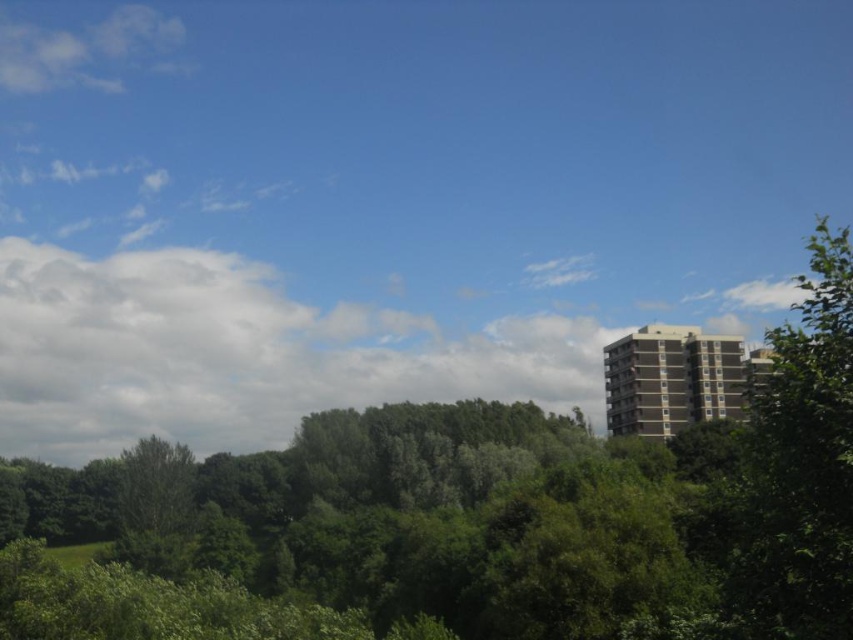
Is green leafy tree at upper center further to the viewer compared to green leafy tree at right?

Yes, green leafy tree at upper center is further from the viewer.

In the scene shown: Is green leafy tree at upper center above green leafy tree at right?

No, green leafy tree at upper center is not above green leafy tree at right.

The image size is (853, 640). Describe the element at coordinates (482, 509) in the screenshot. I see `green leafy tree at upper center` at that location.

Image resolution: width=853 pixels, height=640 pixels. I want to click on green leafy tree at upper center, so click(x=482, y=509).

Does point (828, 422) come closer to viewer compared to point (97, 45)?

Yes.

Is green leafy tree at right below white fluffy cloud at upper left?

Yes.

Is point (766, 465) positioned before point (15, 45)?

Yes, it is in front of point (15, 45).

Find the location of a particular element. The height and width of the screenshot is (640, 853). green leafy tree at right is located at coordinates (793, 474).

Can you confirm if green leafy tree at upper center is shorter than white fluffy cloud at upper left?

No, green leafy tree at upper center is not shorter than white fluffy cloud at upper left.

Locate an element on the screen. This screenshot has width=853, height=640. green leafy tree at upper center is located at coordinates (482, 509).